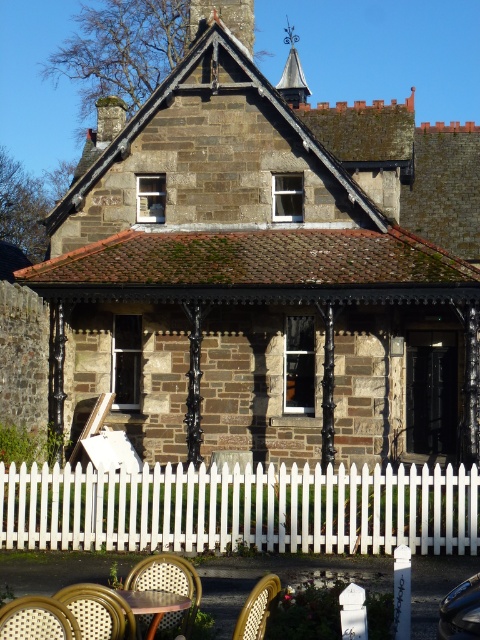
Question: Which of the following is the closest to the observer?

Choices:
 (A) (275, 593)
 (B) (52, 618)

Answer: (B)

Question: Which of these objects is positioned closest to the rattan chair at lower left?

Choices:
 (A) white picket fence at lower center
 (B) wooden table at lower center
 (C) rattan chair at lower center
 (D) wooden woven chair at lower left

Answer: (D)

Question: Can you confirm if braided wood chair at lower center is positioned above rattan chair at lower left?

Choices:
 (A) no
 (B) yes

Answer: (A)

Question: Is white picket fence at lower center behind wooden woven chair at lower center?

Choices:
 (A) no
 (B) yes

Answer: (B)

Question: Which object is closer to the camera taking this photo?

Choices:
 (A) wooden table at lower center
 (B) braided wood chair at lower center

Answer: (A)

Question: Can you confirm if white picket fence at lower center is thinner than wooden woven chair at lower left?

Choices:
 (A) yes
 (B) no

Answer: (B)